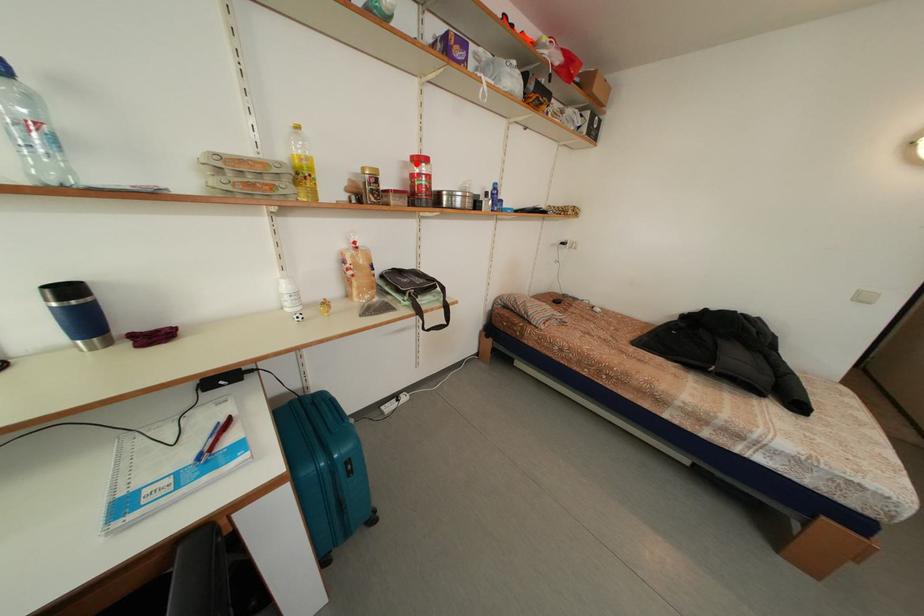
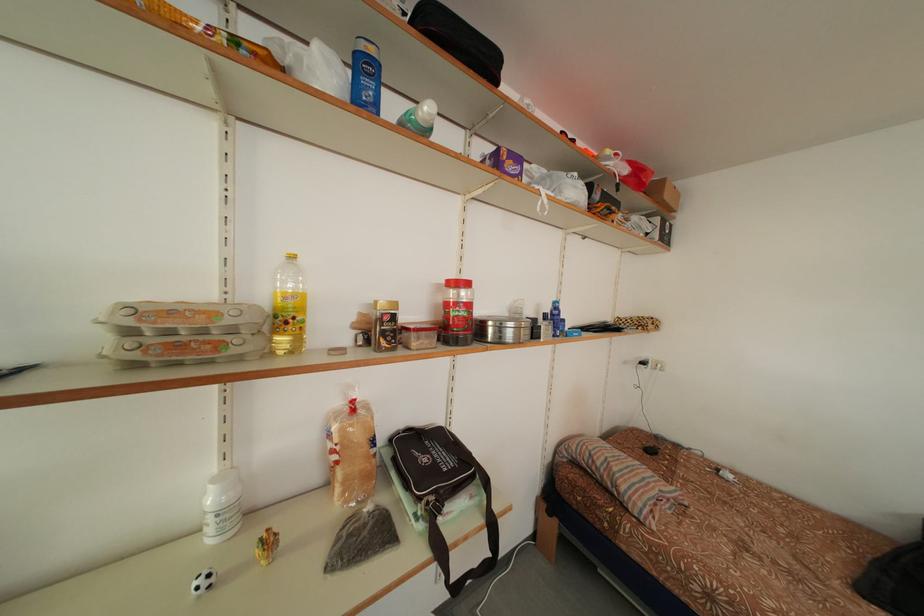
Where in the second image is the point corresponding to the highlighted location from the first image?

(451, 288)